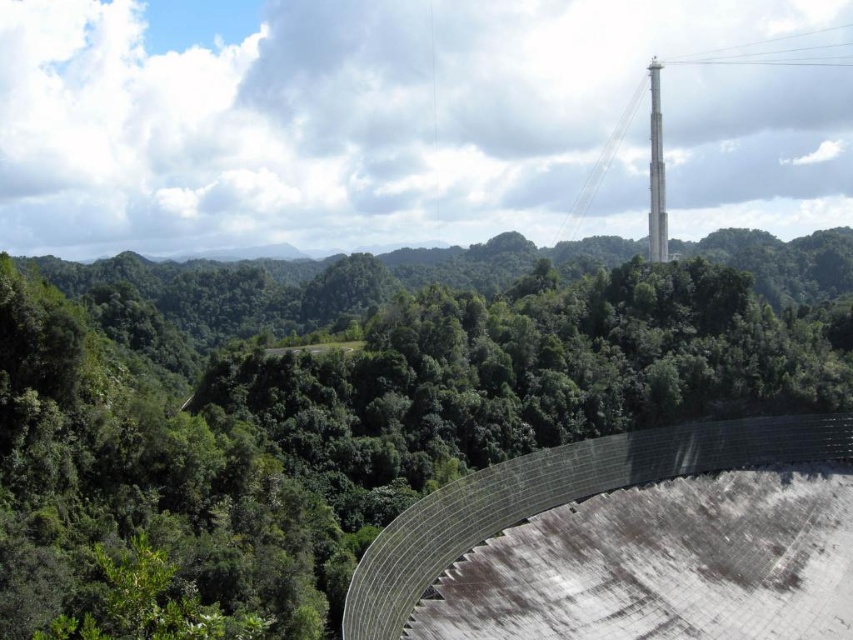
You are a hiker who wants to reach the metallic gray dam at center from your current position near the green leafy forest at center. Given that your average walking speed is 5 km per hour, how long would it take you to reach the dam if you walk directly towards it?

The distance between the green leafy forest at center and the metallic gray dam at center is 148.82 meters. Converting this to kilometers gives 0.14882 km. Dividing this by your walking speed of 5 km per hour yields approximately 0.029764 hours. Multiplying this by 60 minutes gives roughly 1.7858 minutes, so it would take about 1.8 minutes to reach the dam.

You are a hiker planning to take a photo of the green leafy forest at center and the metallic gray dam at center. Which object will occupy more space in your photo?

The green leafy forest at center is larger in size than the metallic gray dam at center, so it will occupy more space in the photo.

You are a hiker planning to cross the metallic gray dam at center. The dam is 10 meters wide. Your hiking backpack has a maximum load capacity of 20 kg. The green leafy forest at center is 15 meters wide. Can you safely cross the dam without overloading your backpack?

The green leafy forest at center is wider than the metallic gray dam at center. However, the question about crossing the dam relates to its own width and your backpack capacity. Since the dam is 10 meters wide and your backpack capacity is 20 kg, the width of the forest doesn